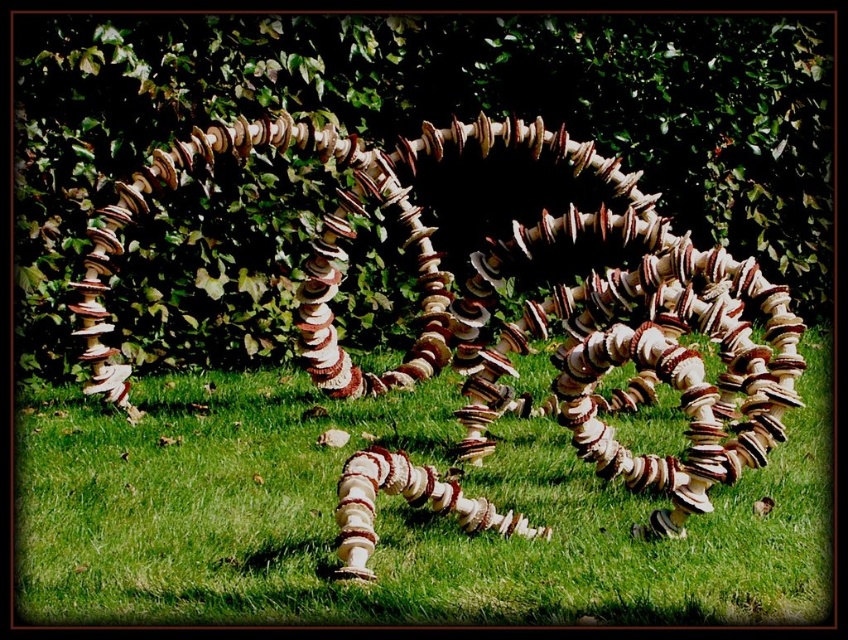
From the picture: You are standing at the edge of the spiral installation and want to take a photo of both the green leafy hedge at center and the white textured mushrooms at center. Which object should you position to your left side to include both in the frame?

You should position the green leafy hedge at center to your left side because it is already to the left of the white textured mushrooms at center, so placing it on your left will keep both in the frame.

You are a gardener planning to place a new decorative statue that is 3 feet wide between the green leafy hedge at center and the white textured mushrooms at center. Will there be enough space between them to fit the statue without moving either object?

The distance between the green leafy hedge at center and the white textured mushrooms at center is 5.06 feet. Since the statue is 3 feet wide, there is sufficient space to place it between them without moving either object, as 5.06 feet is greater than 3 feet.